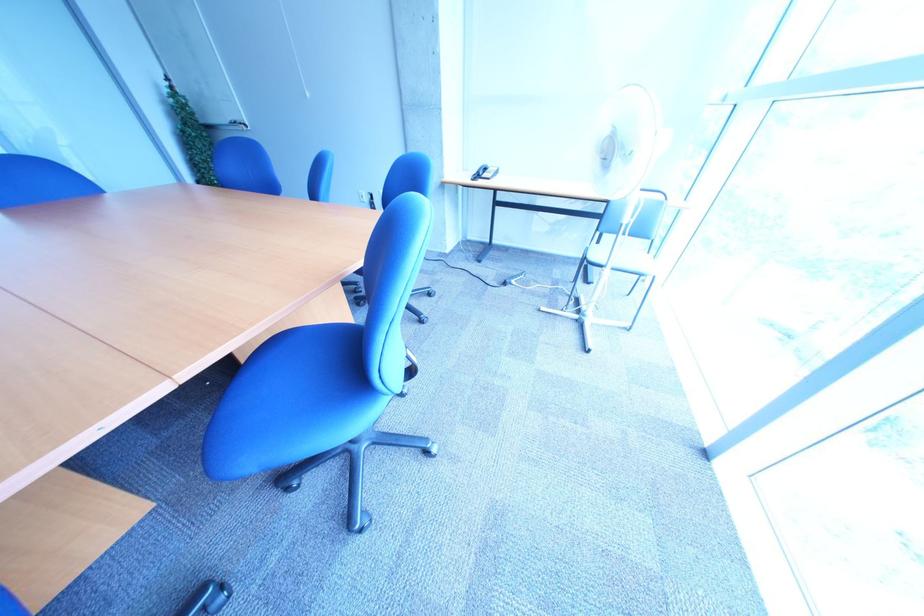
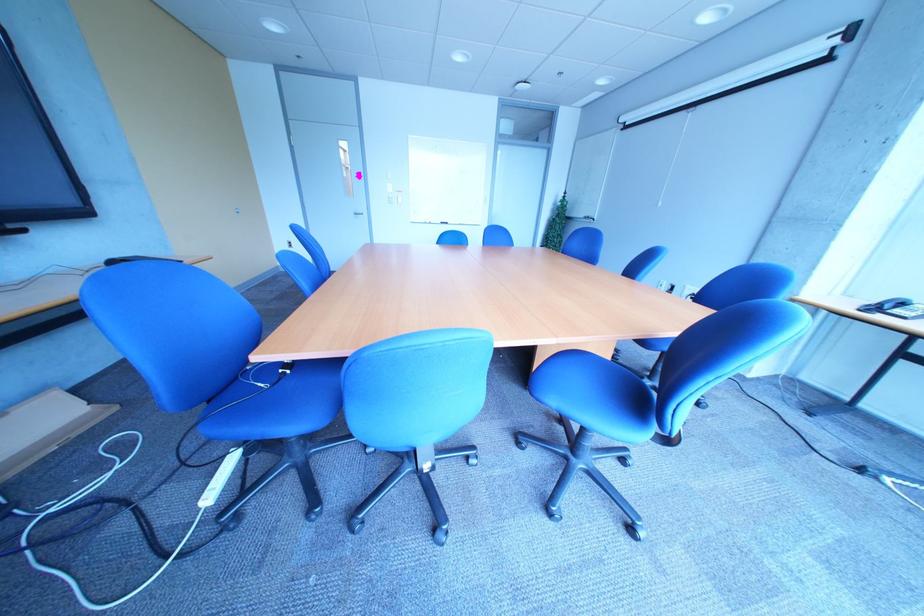
Question: The first image is from the beginning of the video and the second image is from the end. How did the camera likely rotate when shooting the video?

Choices:
 (A) Left
 (B) Right
 (C) Up
 (D) Down

Answer: (A)